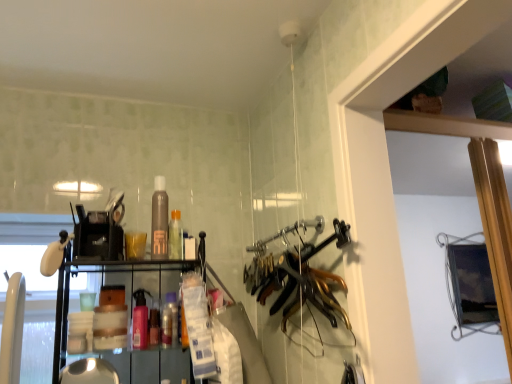
Question: Could gold metallic hangers at center be considered to be inside translucent plastic bottle at center, positioned as the first bottle in bottom-to-top order?

Choices:
 (A) yes
 (B) no

Answer: (B)

Question: Is translucent plastic bottle at center, positioned as the 4th bottle in top-to-bottom order, positioned behind gold metallic hangers at center?

Choices:
 (A) no
 (B) yes

Answer: (B)

Question: From a real-world perspective, is translucent plastic bottle at center, positioned as the first bottle in bottom-to-top order, physically above gold metallic hangers at center?

Choices:
 (A) no
 (B) yes

Answer: (A)

Question: Can you confirm if translucent plastic bottle at center, positioned as the 4th bottle in top-to-bottom order, is wider than gold metallic hangers at center?

Choices:
 (A) yes
 (B) no

Answer: (B)

Question: Does translucent plastic bottle at center, positioned as the first bottle in bottom-to-top order, appear on the right side of gold metallic hangers at center?

Choices:
 (A) no
 (B) yes

Answer: (A)

Question: Considering the relative sizes of translucent plastic bottle at center, positioned as the 4th bottle in top-to-bottom order, and gold metallic hangers at center in the image provided, is translucent plastic bottle at center, positioned as the 4th bottle in top-to-bottom order, smaller than gold metallic hangers at center?

Choices:
 (A) no
 (B) yes

Answer: (B)

Question: Is translucent plastic bottle at center, positioned as the 4th bottle in top-to-bottom order, completely or partially outside of brown matte bottle at center, the 4th bottle when ordered from bottom to top?

Choices:
 (A) no
 (B) yes

Answer: (B)

Question: Is translucent plastic bottle at center, positioned as the first bottle in bottom-to-top order, positioned behind brown matte bottle at center, the 4th bottle when ordered from bottom to top?

Choices:
 (A) yes
 (B) no

Answer: (A)

Question: Can you confirm if translucent plastic bottle at center, positioned as the first bottle in bottom-to-top order, is positioned to the left of brown matte bottle at center, which appears as the 1th bottle when viewed from the top?

Choices:
 (A) no
 (B) yes

Answer: (A)

Question: Is translucent plastic bottle at center, positioned as the first bottle in bottom-to-top order, with brown matte bottle at center, the 4th bottle when ordered from bottom to top?

Choices:
 (A) no
 (B) yes

Answer: (A)

Question: From the image's perspective, does translucent plastic bottle at center, positioned as the first bottle in bottom-to-top order, appear higher than brown matte bottle at center, which appears as the 1th bottle when viewed from the top?

Choices:
 (A) yes
 (B) no

Answer: (B)

Question: Can you confirm if translucent plastic bottle at center, positioned as the 4th bottle in top-to-bottom order, is smaller than brown matte bottle at center, which appears as the 1th bottle when viewed from the top?

Choices:
 (A) no
 (B) yes

Answer: (B)

Question: Could brown matte bottle at center, which appears as the 1th bottle when viewed from the top, be considered to be inside pink matte spray bottle at center, which ranks as the 2th bottle in bottom-to-top order?

Choices:
 (A) yes
 (B) no

Answer: (B)